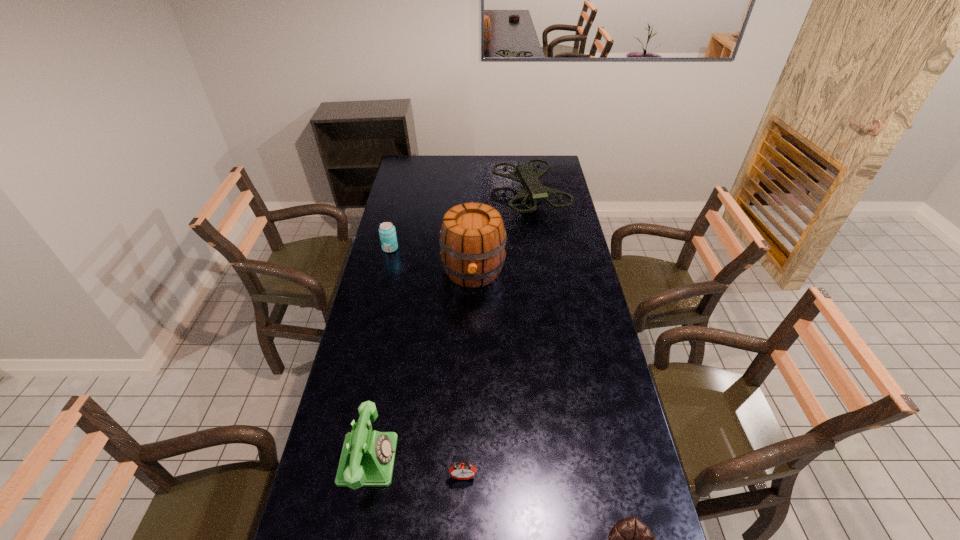
Find the location of a particular element. free space between the beer can and the alarm clock is located at coordinates (427, 362).

Find the location of a particular element. This screenshot has width=960, height=540. empty location between the alarm clock and the third tallest object is located at coordinates (416, 468).

Choose which object is the nearest neighbor to the fifth tallest object. Please provide its 2D coordinates. Your answer should be formatted as a tuple, i.e. [(x, y)], where the tuple contains the x and y coordinates of a point satisfying the conditions above.

[(367, 459)]

This screenshot has width=960, height=540. Identify the location of object that can be found as the third closest to the fifth tallest object. (472, 237).